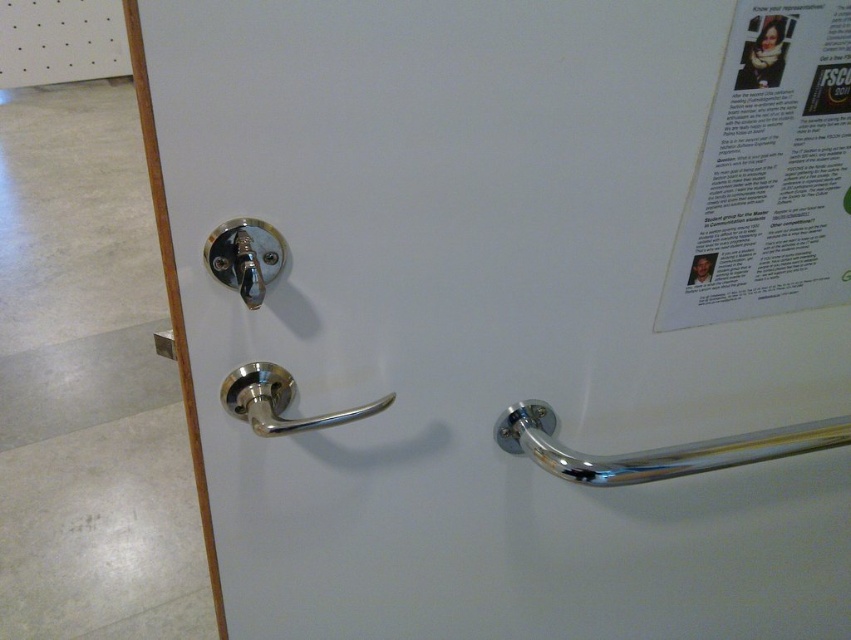
Based on the photo, between chrome/metallic handle at lower right and polished metal door handle at center-left, which one appears on the right side from the viewer's perspective?

From the viewer's perspective, chrome/metallic handle at lower right appears more on the right side.

Can you confirm if chrome/metallic handle at lower right is wider than polished metal door handle at center-left?

Correct, the width of chrome/metallic handle at lower right exceeds that of polished metal door handle at center-left.

Locate an element on the screen. This screenshot has height=640, width=851. chrome/metallic handle at lower right is located at coordinates 655,449.

Between chrome/metallic handle at lower right and polished metal lock at upper left, which one is positioned lower?

chrome/metallic handle at lower right is below.

Is point (586, 476) closer to camera compared to point (241, 224)?

No, it is not.

The height and width of the screenshot is (640, 851). I want to click on chrome/metallic handle at lower right, so click(x=655, y=449).

Is point (820, 24) closer to viewer compared to point (243, 275)?

No, it is behind (243, 275).

Which of these two, white paper poster at upper right or polished metal lock at upper left, stands taller?

white paper poster at upper right is taller.

Does point (760, 289) lie in front of point (213, 262)?

No.

Image resolution: width=851 pixels, height=640 pixels. In order to click on white paper poster at upper right in this screenshot , I will do `click(769, 172)`.